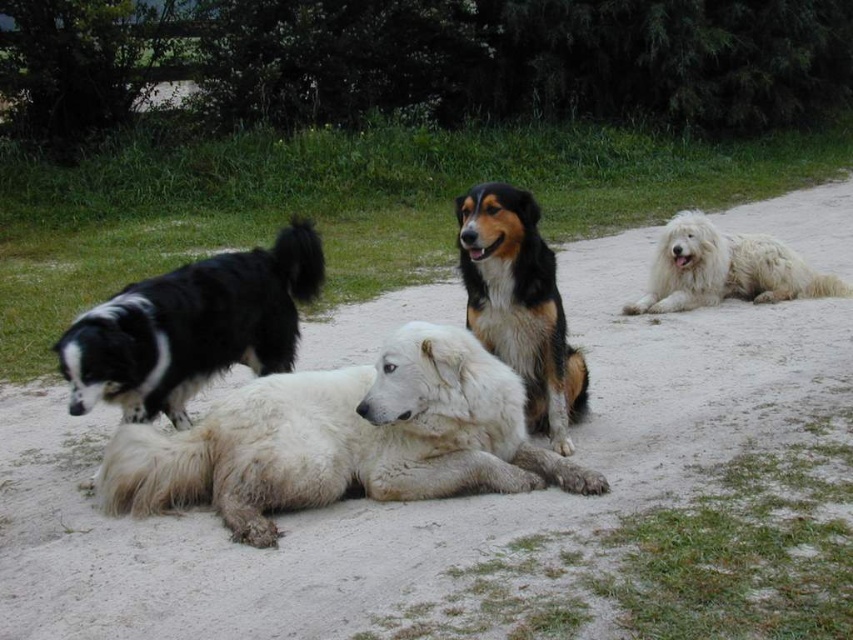
You are standing at the origin point in the image. There are two points marked in the scene. Which point, point [601,310] or point [558,445], is closer to you?

Point [558,445] is closer to you because it is in front of point [601,310].

You are a photographer trying to capture a group photo of the white fluffy dog at center and the black and white fur at left. If you want to frame both dogs equally in your shot, which dog should you move closer to the camera and why?

You should move the black and white fur at left closer to the camera because the white fluffy dog at center is wider than the black and white fur at left. By moving the smaller dog forward, you can balance their sizes in the frame.